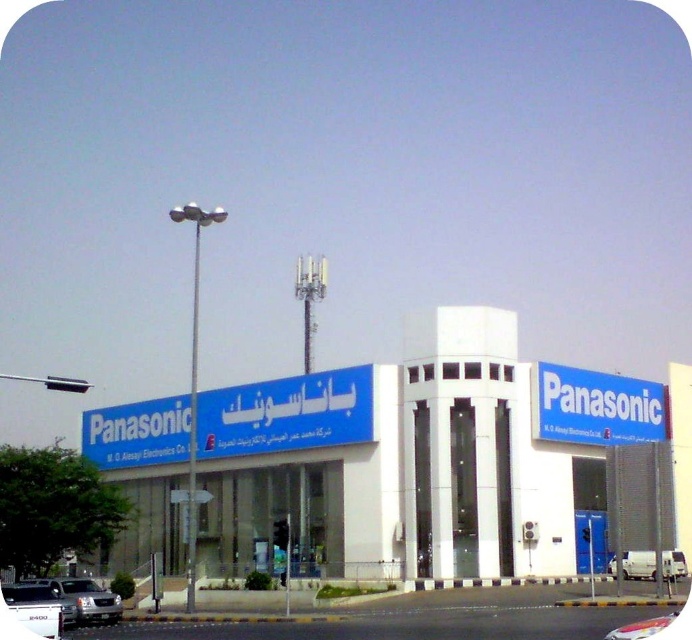
You are standing in front of the Panasonic building and want to take a photo. There are two points marked on the building at coordinates point (42, 602) and point (650, 552). Which point will appear larger in your photo?

Point (42, 602) is closer to the camera than point (650, 552), so it will appear larger in the photo.

You are a delivery person needing to park your white matte van at lower left and white matte van at lower right in a garage with a height limit of 2 meters. Which van should you park first to avoid exceeding the garage height limit?

The white matte van at lower right should be parked first since it has a lesser height compared to the white matte van at lower left, which is taller and might exceed the garage height limit.

You are a delivery driver who needs to park your vehicle in the parking lot behind the Panasonic building. The parking spaces are designed to accommodate vehicles up to 1.6 meters in height. You have a silver metallic sedan at lower left and a white matte van at lower right. Which vehicle can safely park without exceeding the height limit?

The white matte van at lower right can safely park without exceeding the height limit because the silver metallic sedan at lower left is taller than it.